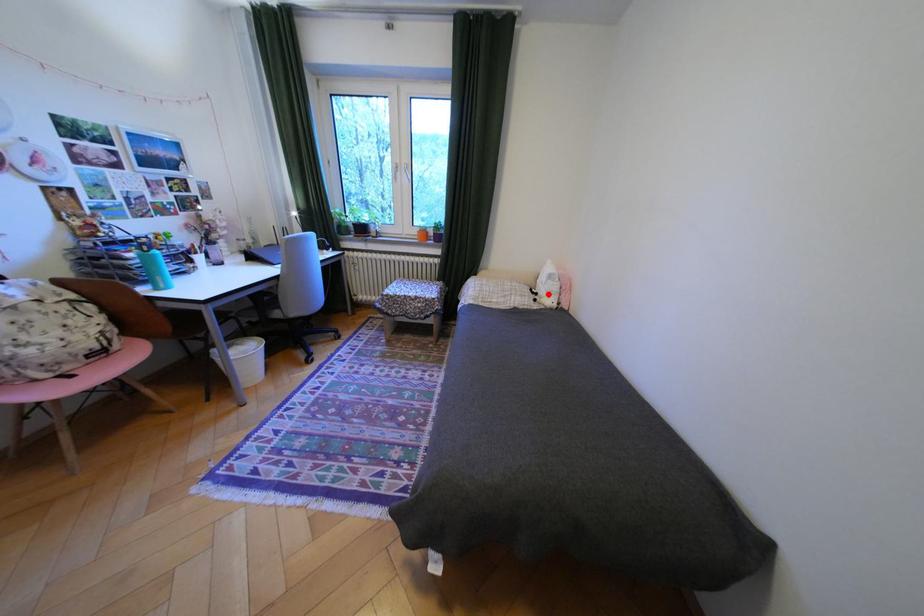
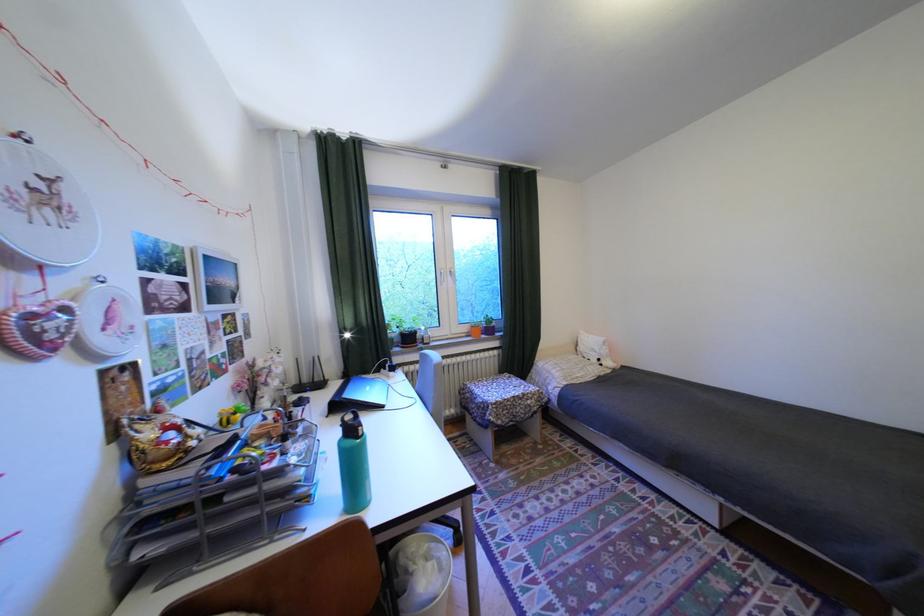
Question: I am providing you with two images of the same scene from different viewpoints. In image1, a red point is highlighted. Considering the same 3D point in image2, which of the following is correct?

Choices:
 (A) It is closer
 (B) It is farther

Answer: (B)